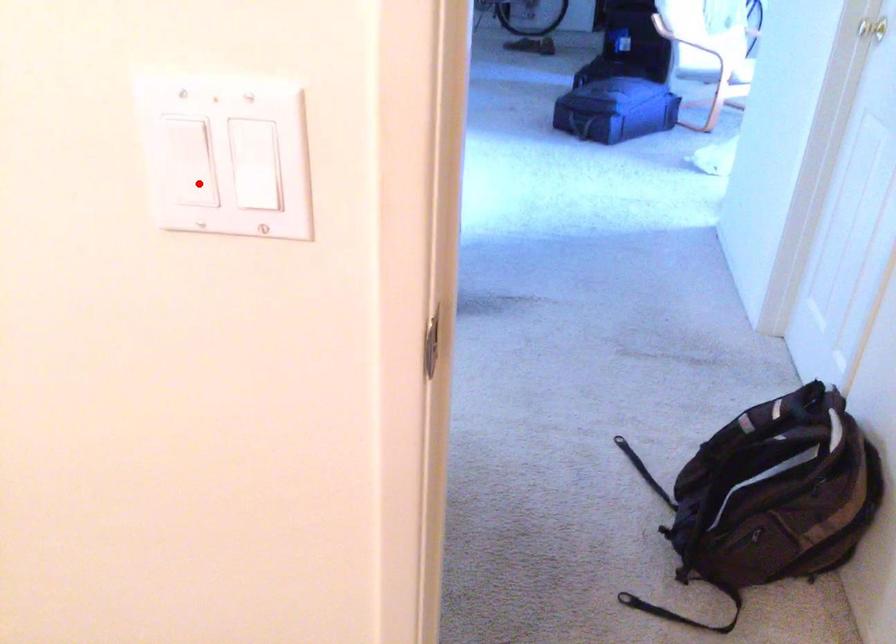
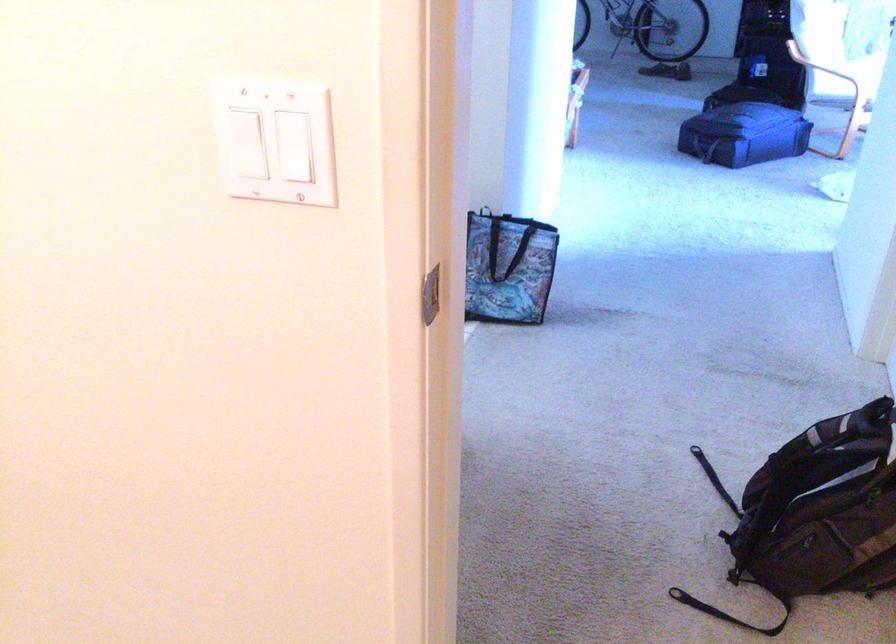
Locate, in the second image, the point that corresponds to the highlighted location in the first image.

(242, 143)